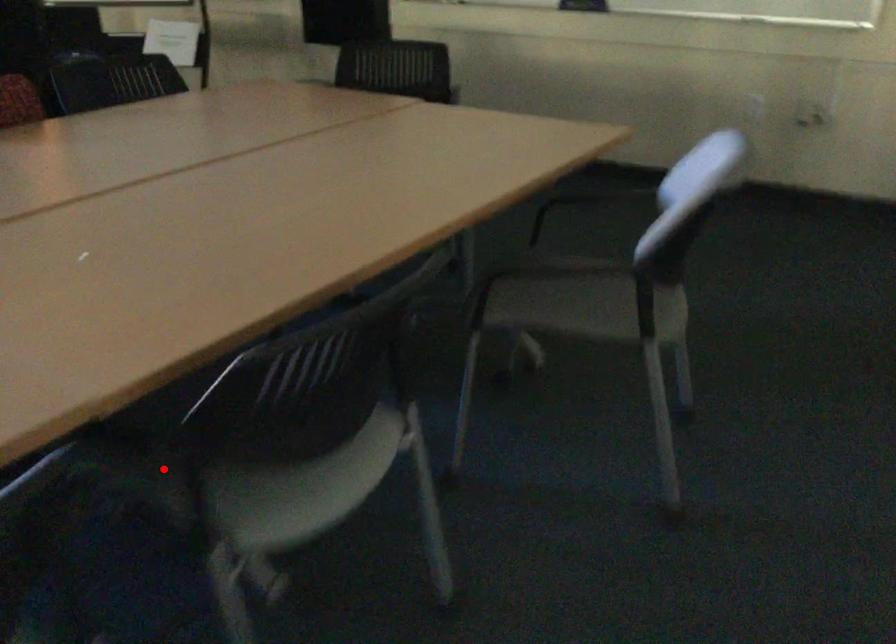
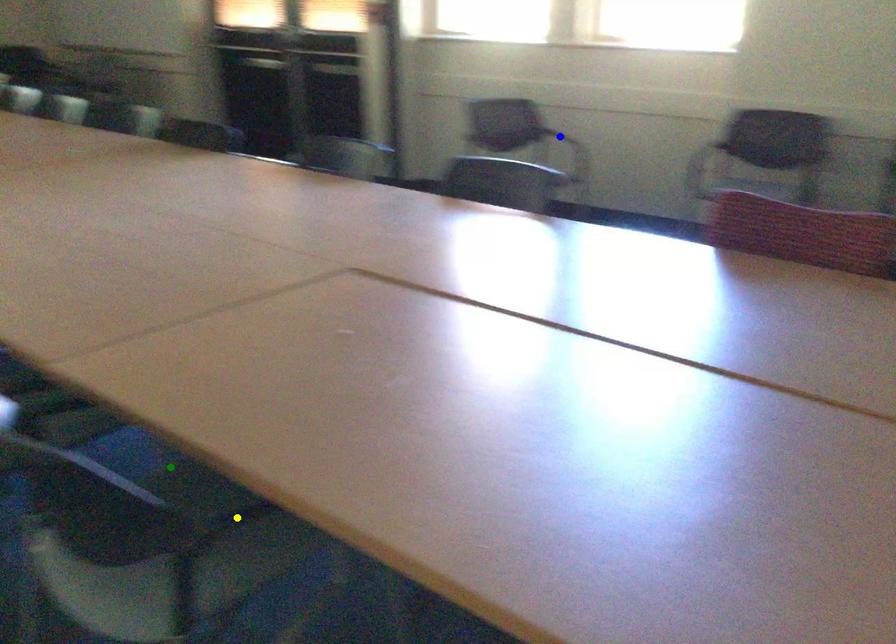
Question: I am providing you with two images of the same scene from different viewpoints. A red point is marked on the first image. You are given multiple points on the second image. Which spot in image 2 lines up with the point in image 1?

Choices:
 (A) yellow point
 (B) green point
 (C) blue point

Answer: (B)